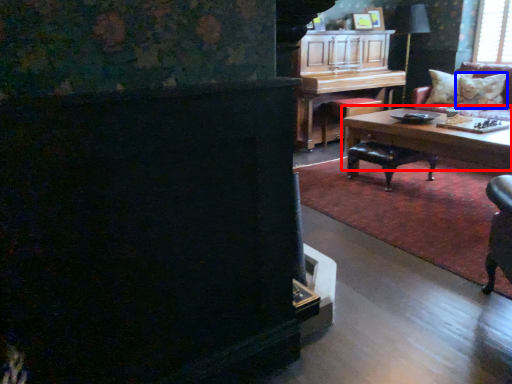
Question: Among these objects, which one is farthest to the camera, coffee table (highlighted by a red box) or pillow (highlighted by a blue box)?

Choices:
 (A) coffee table
 (B) pillow

Answer: (B)